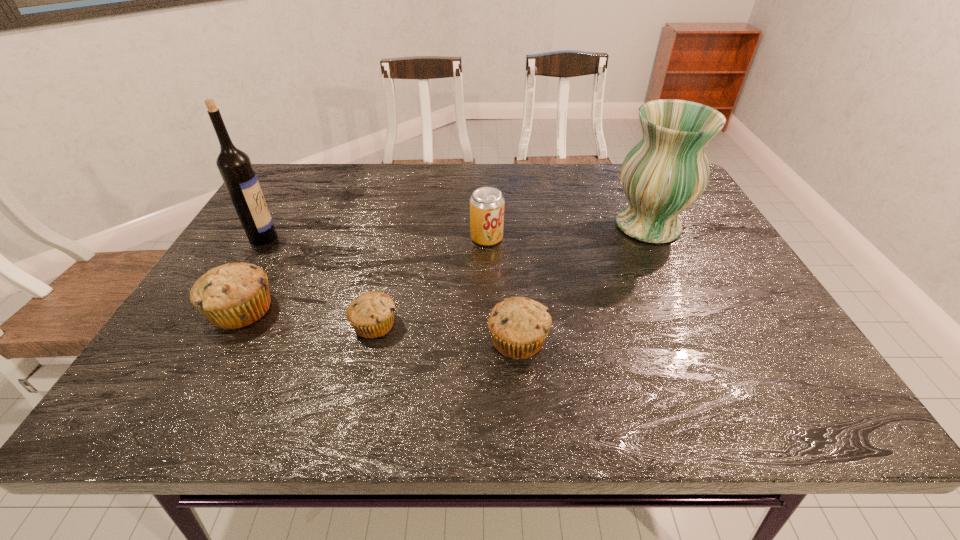
This screenshot has height=540, width=960. Identify the location of vacant place for an extra muffin on the right. (671, 358).